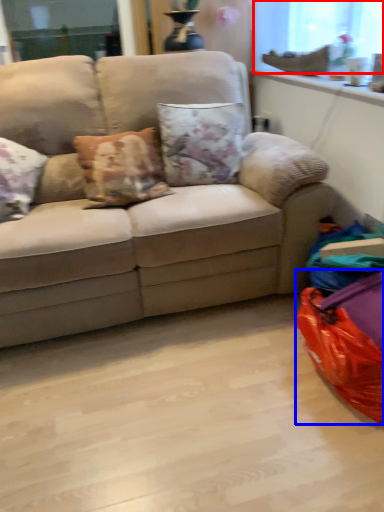
Question: Which of the following is the farthest to the observer, window screen (highlighted by a red box) or bean bag chair (highlighted by a blue box)?

Choices:
 (A) window screen
 (B) bean bag chair

Answer: (A)